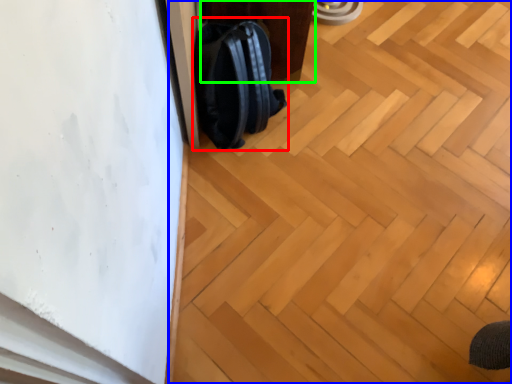
Question: Estimate the real-world distances between objects in this image. Which object is closer to backpack (highlighted by a red box), plywood (highlighted by a blue box) or furniture (highlighted by a green box)?

Choices:
 (A) plywood
 (B) furniture

Answer: (B)